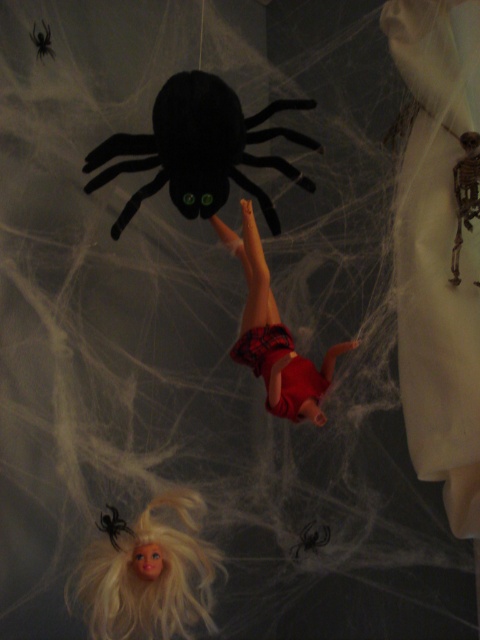
Is point (88, 545) in front of point (295, 410)?

No, (88, 545) is further to viewer.

The width and height of the screenshot is (480, 640). What do you see at coordinates (147, 572) in the screenshot?
I see `blonde hair doll at lower left` at bounding box center [147, 572].

Image resolution: width=480 pixels, height=640 pixels. I want to click on blonde hair doll at lower left, so click(147, 572).

Between point (250, 328) and point (316, 522), which one is positioned behind?

The point (316, 522) is behind.

Does point (274, 404) come closer to viewer compared to point (304, 531)?

Yes, point (274, 404) is closer to viewer.

Describe the element at coordinates (276, 330) in the screenshot. The width and height of the screenshot is (480, 640). I see `matte red shorts at center` at that location.

Where is `matte red shorts at center`? This screenshot has height=640, width=480. matte red shorts at center is located at coordinates (276, 330).

Between black fuzzy spider at upper center and blonde hair doll at lower left, which one is positioned higher?

black fuzzy spider at upper center is above.

Can you confirm if black fuzzy spider at upper center is thinner than blonde hair doll at lower left?

Incorrect, black fuzzy spider at upper center's width is not less than blonde hair doll at lower left's.

Image resolution: width=480 pixels, height=640 pixels. In order to click on black fuzzy spider at upper center in this screenshot , I will do `click(199, 148)`.